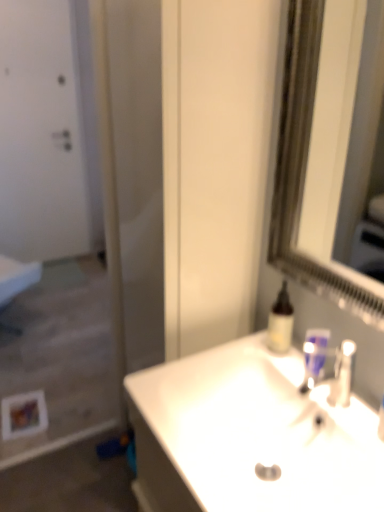
Question: Which direction should I rotate to face blue plastic mouthwash at sink, the first mouthwash viewed from the right, — up or down?

Choices:
 (A) up
 (B) down

Answer: (B)

Question: Is the position of translucent plastic bottle at upper right, acting as the 2th mouthwash starting from the right, more distant than that of white matte screen door at left?

Choices:
 (A) yes
 (B) no

Answer: (A)

Question: Is translucent plastic bottle at upper right, which is the first mouthwash in left-to-right order, at the left side of white matte screen door at left?

Choices:
 (A) no
 (B) yes

Answer: (A)

Question: Is translucent plastic bottle at upper right, which is the first mouthwash in left-to-right order, smaller than white matte screen door at left?

Choices:
 (A) no
 (B) yes

Answer: (B)

Question: Considering the relative sizes of translucent plastic bottle at upper right, acting as the 2th mouthwash starting from the right, and white matte screen door at left in the image provided, is translucent plastic bottle at upper right, acting as the 2th mouthwash starting from the right, thinner than white matte screen door at left?

Choices:
 (A) no
 (B) yes

Answer: (B)

Question: From the image's perspective, is translucent plastic bottle at upper right, which is the first mouthwash in left-to-right order, over white matte screen door at left?

Choices:
 (A) no
 (B) yes

Answer: (A)

Question: Does translucent plastic bottle at upper right, which is the first mouthwash in left-to-right order, have a larger size compared to white matte screen door at left?

Choices:
 (A) yes
 (B) no

Answer: (B)

Question: Considering the relative sizes of white matte door at upper left and translucent plastic bottle at upper right, acting as the 2th mouthwash starting from the right, in the image provided, is white matte door at upper left thinner than translucent plastic bottle at upper right, acting as the 2th mouthwash starting from the right,?

Choices:
 (A) yes
 (B) no

Answer: (A)

Question: From a real-world perspective, is white matte door at upper left below translucent plastic bottle at upper right, acting as the 2th mouthwash starting from the right?

Choices:
 (A) yes
 (B) no

Answer: (B)

Question: Is white matte door at upper left further to the viewer compared to translucent plastic bottle at upper right, acting as the 2th mouthwash starting from the right?

Choices:
 (A) no
 (B) yes

Answer: (B)

Question: Is white matte door at upper left shorter than translucent plastic bottle at upper right, acting as the 2th mouthwash starting from the right?

Choices:
 (A) no
 (B) yes

Answer: (A)

Question: Is white matte door at upper left not near translucent plastic bottle at upper right, acting as the 2th mouthwash starting from the right?

Choices:
 (A) yes
 (B) no

Answer: (A)

Question: Would you say white matte door at upper left contains translucent plastic bottle at upper right, acting as the 2th mouthwash starting from the right?

Choices:
 (A) no
 (B) yes

Answer: (A)

Question: Can you confirm if translucent plastic bottle at upper right, which is the first mouthwash in left-to-right order, is taller than white glossy sink at center?

Choices:
 (A) no
 (B) yes

Answer: (B)